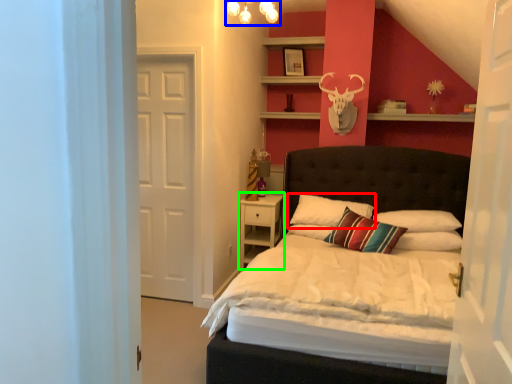
Question: Considering the real-world distances, which object is closest to pillow (highlighted by a red box)? light fixture (highlighted by a blue box) or nightstand (highlighted by a green box).

Choices:
 (A) light fixture
 (B) nightstand

Answer: (B)